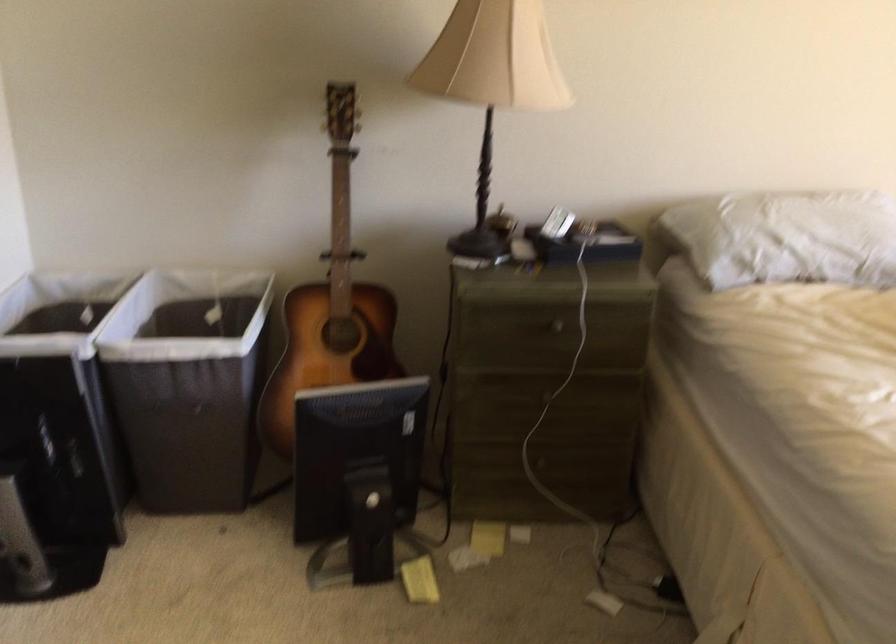
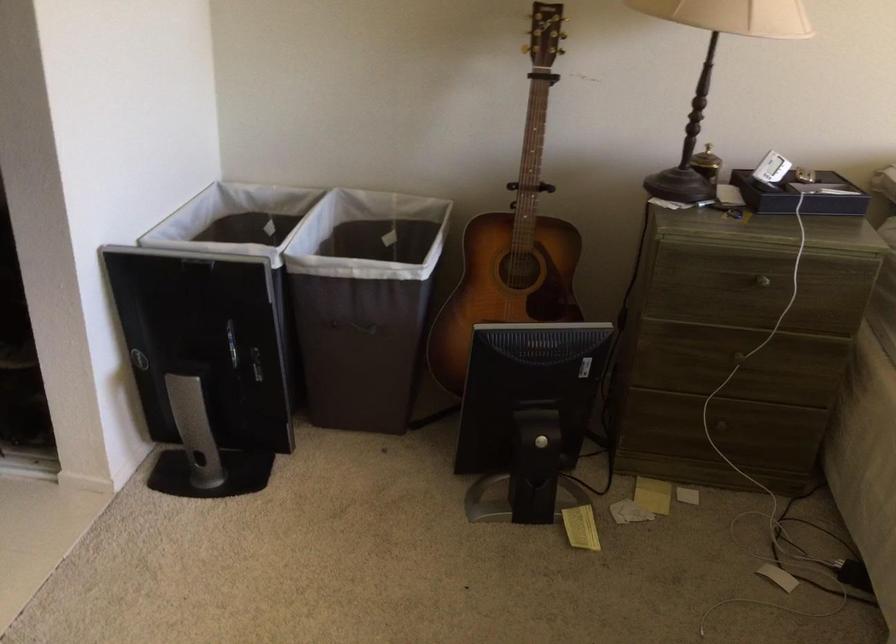
Find the pixel in the second image that matches pixel 186 408 in the first image.

(357, 327)